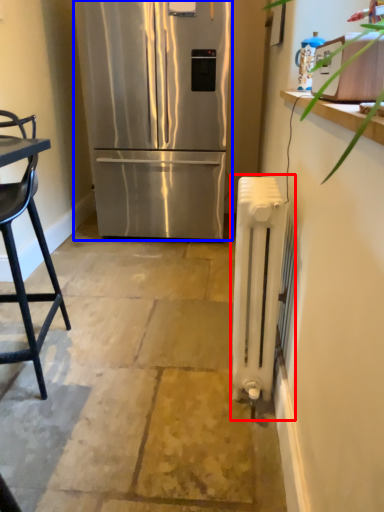
Question: Among these objects, which one is farthest to the camera, radiator (highlighted by a red box) or refrigerator (highlighted by a blue box)?

Choices:
 (A) radiator
 (B) refrigerator

Answer: (B)